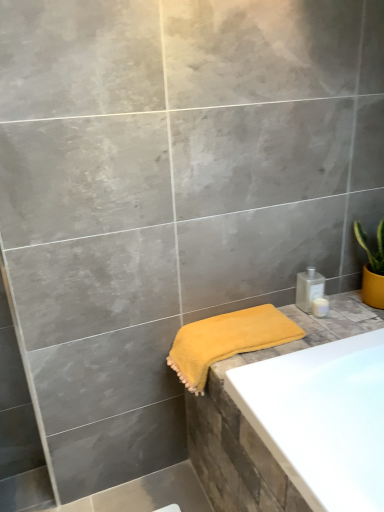
Locate an element on the screen. vacant space in front of white glossy soap dispenser at upper right, the first toiletry when ordered from bottom to top is located at coordinates (320, 333).